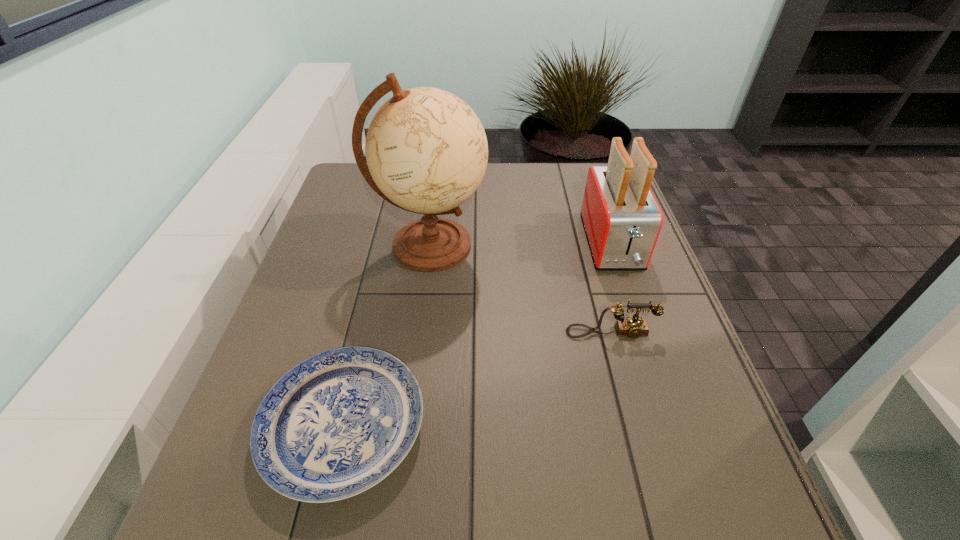
The image size is (960, 540). What are the coordinates of `the tallest object` in the screenshot? It's located at click(426, 150).

The image size is (960, 540). What are the coordinates of `the third shortest object` in the screenshot? It's located at (622, 219).

The width and height of the screenshot is (960, 540). I want to click on telephone, so click(633, 327).

Where is `the second shortest object`? the second shortest object is located at coordinates (633, 327).

Locate an element on the screen. The width and height of the screenshot is (960, 540). plate is located at coordinates (338, 423).

Image resolution: width=960 pixels, height=540 pixels. In order to click on the nearest object in this screenshot , I will do `click(338, 423)`.

The height and width of the screenshot is (540, 960). I want to click on vacant space located on the surface of the tallest object, so click(x=633, y=246).

Identify the location of vacant space located on the front-facing side of the toaster. (654, 368).

The height and width of the screenshot is (540, 960). Find the location of `free point located 0.220m on the front-facing side of the third farthest object`. free point located 0.220m on the front-facing side of the third farthest object is located at coordinates (638, 436).

I want to click on blank area located on the back of the shortest object, so click(x=365, y=337).